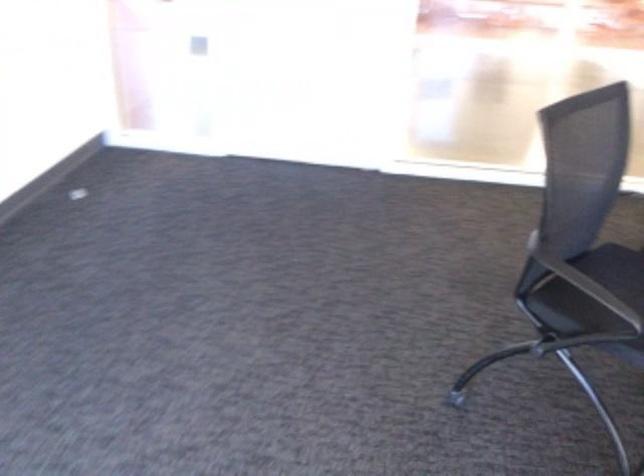
At what (x,y) coordinates should I click in order to perform the action: click on chair sitting surface. Please return your answer as a coordinate pair (x, y). The width and height of the screenshot is (644, 476). Looking at the image, I should click on [616, 269].